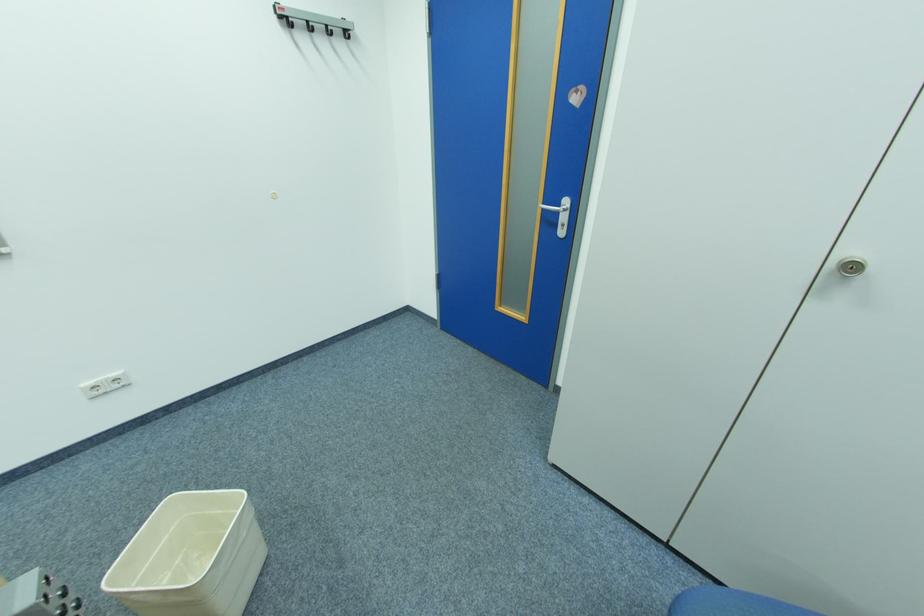
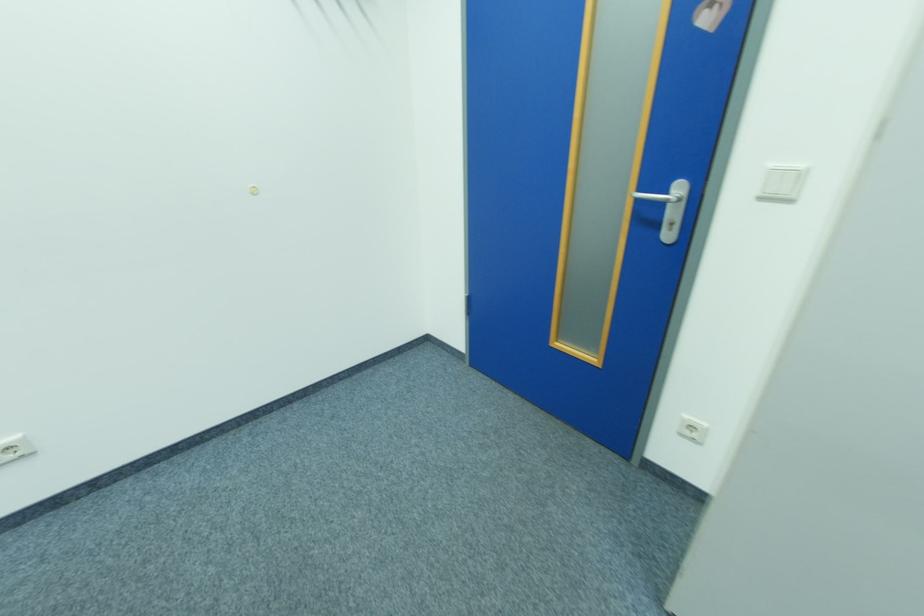
Question: In a continuous first-person perspective shot, in which direction is the camera moving?

Choices:
 (A) Left
 (B) Right
 (C) Forward
 (D) Backward

Answer: (C)